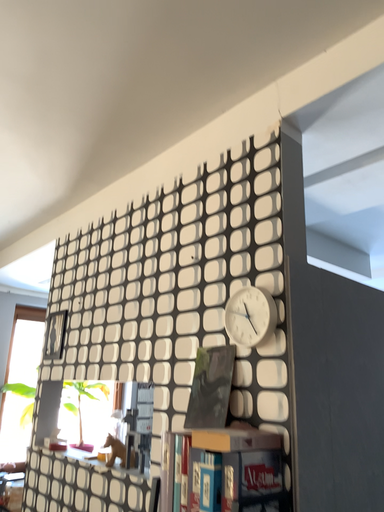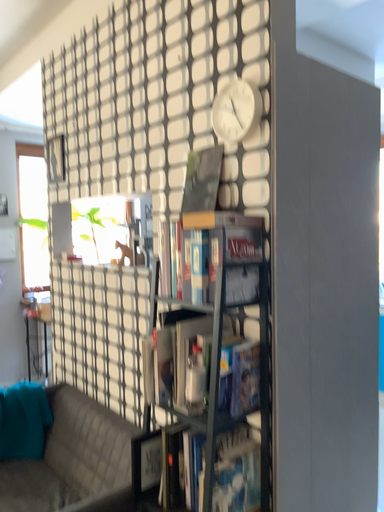
Question: Which way did the camera rotate in the video?

Choices:
 (A) rotated downward
 (B) rotated upward

Answer: (A)